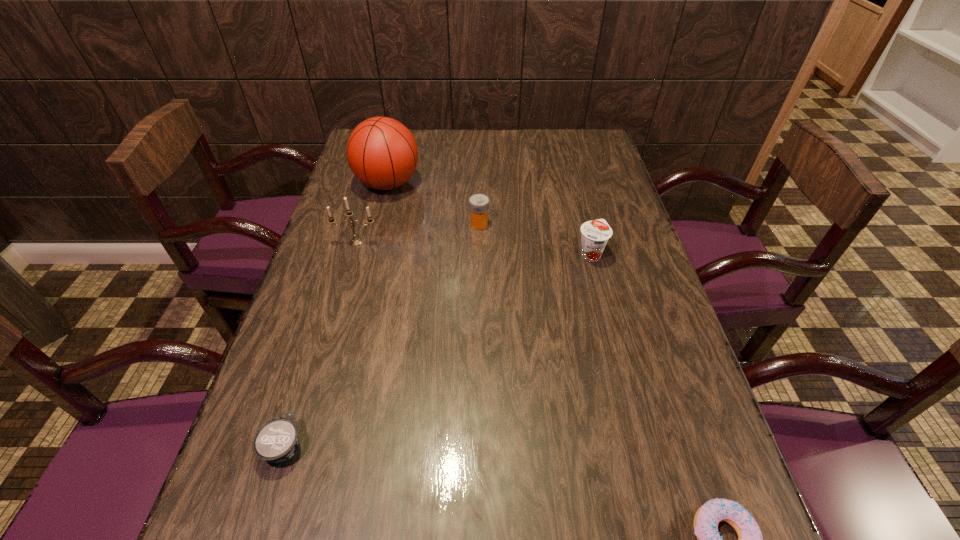
The height and width of the screenshot is (540, 960). I want to click on vacant region at the right edge of the desktop, so click(598, 208).

Image resolution: width=960 pixels, height=540 pixels. In the image, there is a desktop. Identify the location of vacant space at the far right corner. (577, 143).

You are a GUI agent. You are given a task and a screenshot of the screen. Output one action in this format:
    pyautogui.click(x=<x>, y=<y>)
    Task: Click on the free space that is in between the fifth nearest object and the second tallest object
    The image size is (960, 540).
    Given the screenshot: What is the action you would take?
    pyautogui.click(x=418, y=233)

I want to click on free spot between the right yogurt and the candle, so click(x=473, y=248).

Identify the location of free space between the farthest object and the right yogurt. This screenshot has height=540, width=960. (490, 219).

Where is `free space between the fifth nearest object and the candle`? free space between the fifth nearest object and the candle is located at coordinates (418, 233).

At what (x,y) coordinates should I click in order to perform the action: click on free point between the shorter yogurt and the medicine. Please return your answer as a coordinate pair (x, y). Image resolution: width=960 pixels, height=540 pixels. Looking at the image, I should click on pos(382,335).

I want to click on object that ranks as the fifth closest to the basketball, so click(706, 520).

In order to click on object that is the third closest one to the nearest object in this screenshot , I will do `click(478, 203)`.